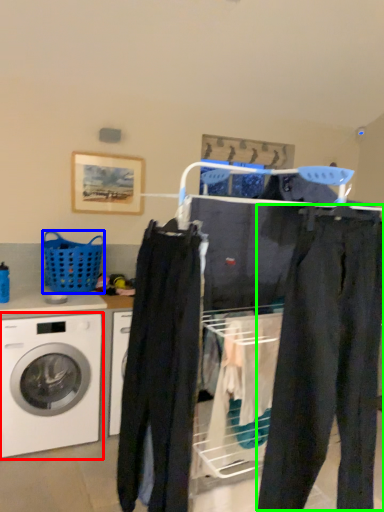
Question: Based on their relative distances, which object is nearer to washing machine (highlighted by a red box)? Choose from basket (highlighted by a blue box) and pants (highlighted by a green box).

Choices:
 (A) basket
 (B) pants

Answer: (A)